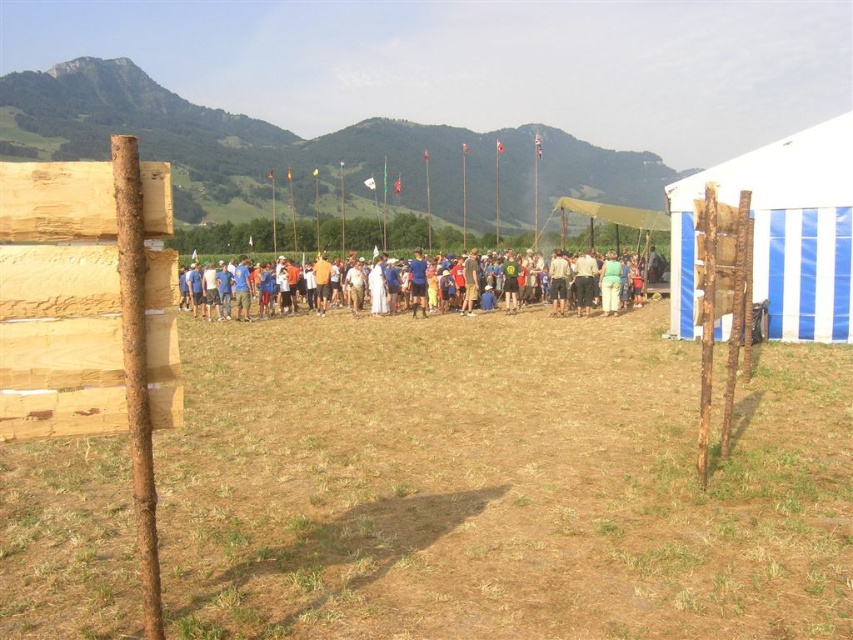
Is brown dry grass at center positioned behind blue fabric people at center?

That is False.

Between brown dry grass at center and blue fabric people at center, which one appears on the left side from the viewer's perspective?

From the viewer's perspective, blue fabric people at center appears more on the left side.

At what (x,y) coordinates should I click in order to perform the action: click on brown dry grass at center. Please return your answer as a coordinate pair (x, y). The width and height of the screenshot is (853, 640). Looking at the image, I should click on (498, 484).

Consider the image. Measure the distance between brown dry grass at center and blue striped tent at right.

7.22 meters

Which is behind, point (792, 488) or point (828, 157)?

Positioned behind is point (828, 157).

Where is `brown dry grass at center`? This screenshot has height=640, width=853. brown dry grass at center is located at coordinates (498, 484).

Does blue striped tent at right have a lesser height compared to blue fabric people at center?

Incorrect, blue striped tent at right's height does not fall short of blue fabric people at center's.

Can you confirm if blue striped tent at right is wider than blue fabric people at center?

No, blue striped tent at right is not wider than blue fabric people at center.

Measure the distance between blue striped tent at right and camera.

blue striped tent at right is 15.64 meters away from camera.

What are the coordinates of `blue striped tent at right` in the screenshot? It's located at (780, 232).